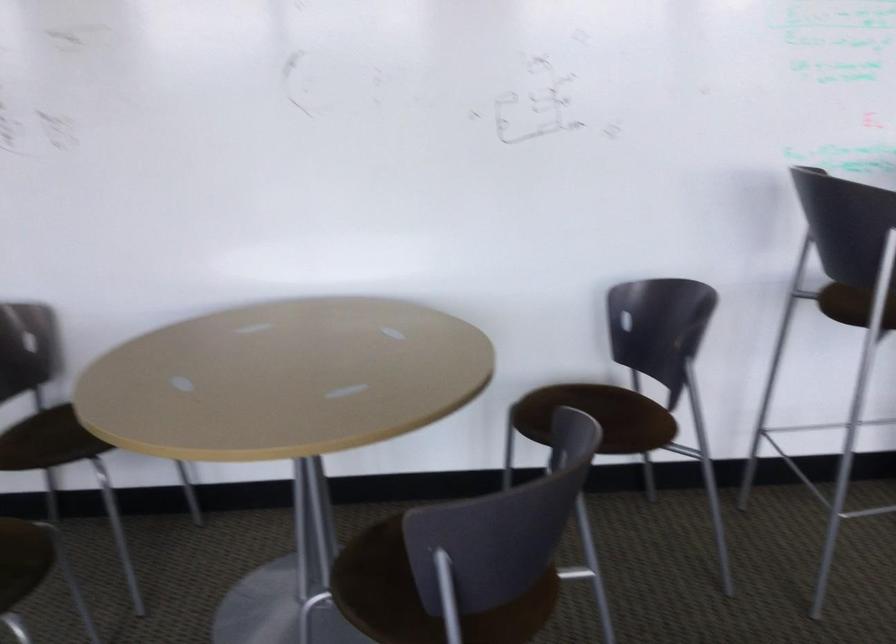
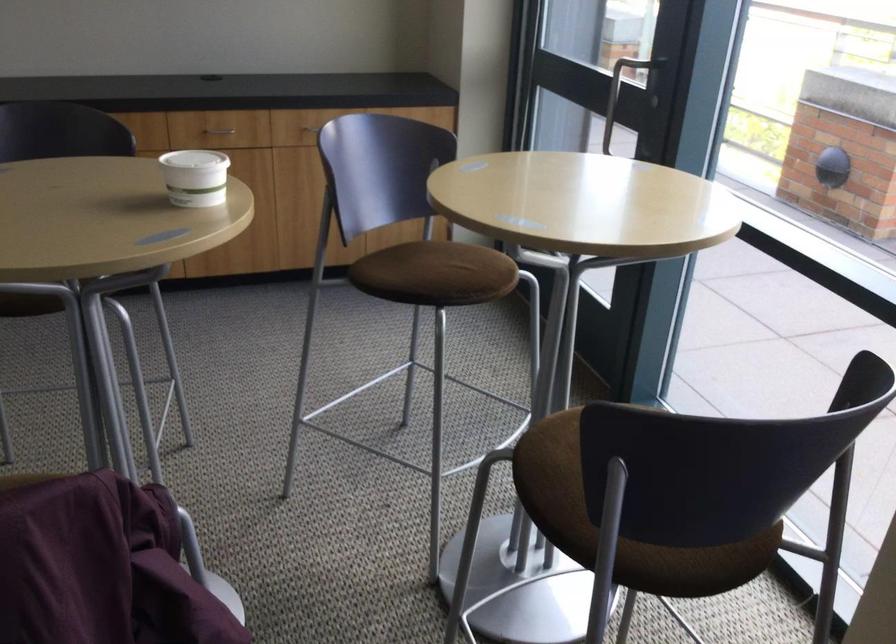
The first image is from the beginning of the video and the second image is from the end. How did the camera likely rotate when shooting the video?

The rotation direction of the camera is right-down.